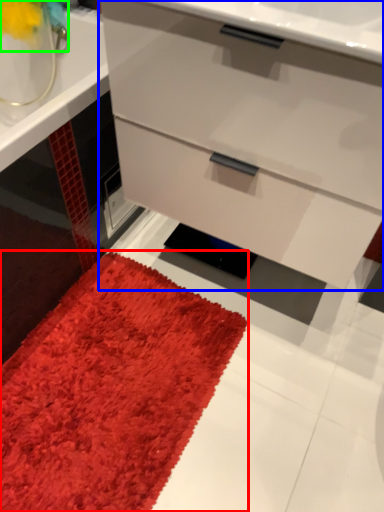
Question: Which is farther away from mat (highlighted by a red box)? chest of drawers (highlighted by a blue box) or flower (highlighted by a green box)?

Choices:
 (A) chest of drawers
 (B) flower

Answer: (B)